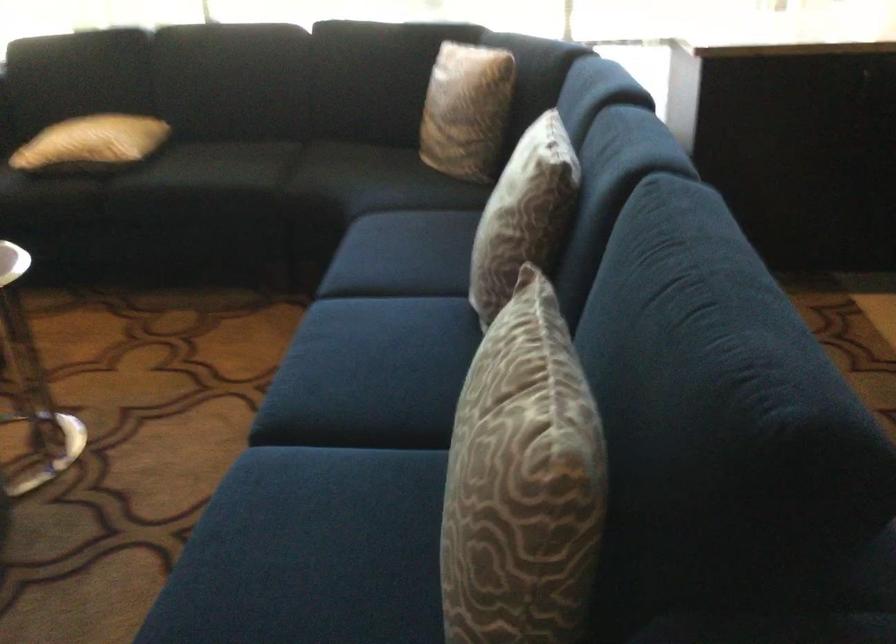
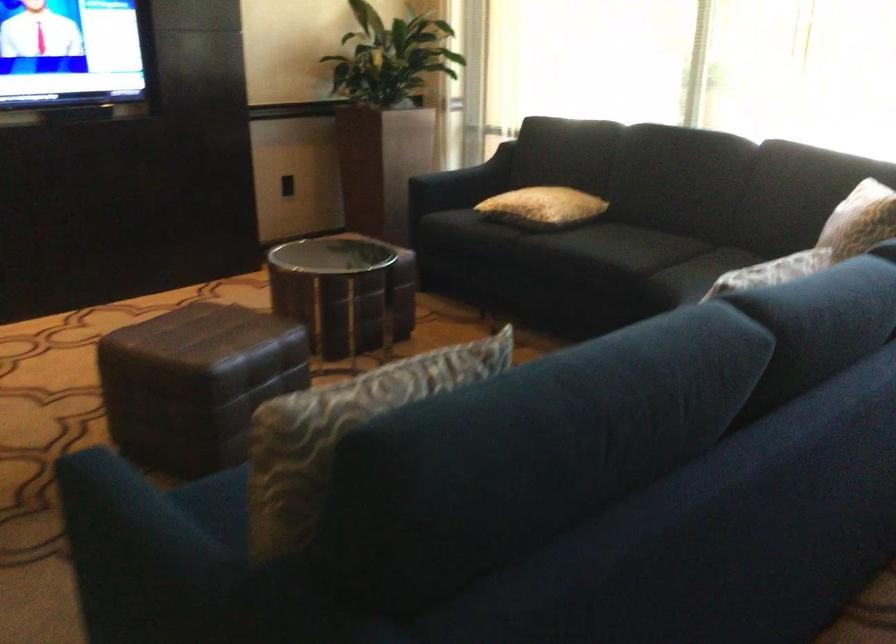
Find the pixel in the second image that matches point 106,144 in the first image.

(543, 207)